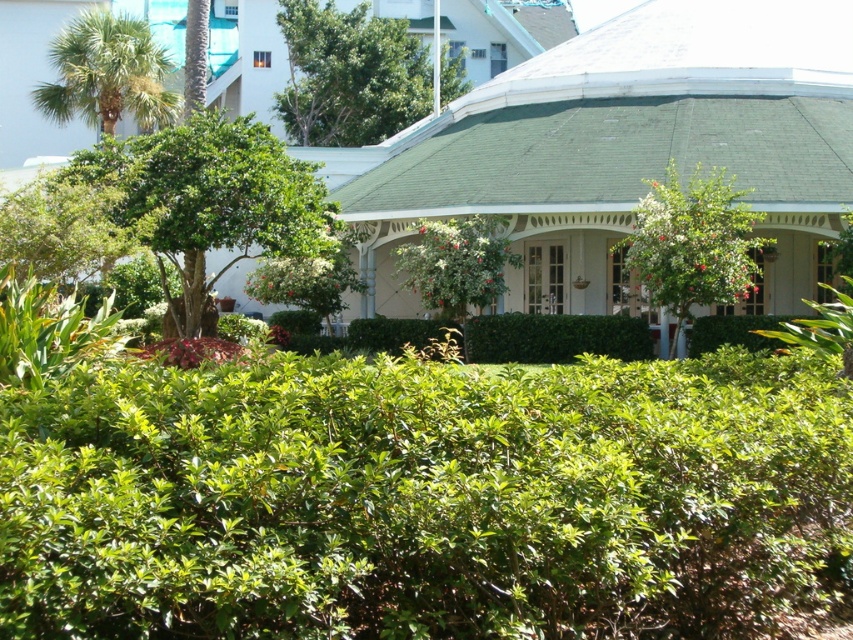
Where is `green leafy hedge at center`? Image resolution: width=853 pixels, height=640 pixels. green leafy hedge at center is located at coordinates (424, 499).

Locate an element on the screen. The width and height of the screenshot is (853, 640). green leafy hedge at center is located at coordinates (424, 499).

Can you confirm if green leafy hedge at center is positioned to the left of green leafy tree at upper center?

Incorrect, green leafy hedge at center is not on the left side of green leafy tree at upper center.

Between green leafy hedge at center and green leafy tree at upper center, which one has less height?

green leafy hedge at center is shorter.

Is point (532, 481) behind point (381, 17)?

No, it is in front of (381, 17).

Image resolution: width=853 pixels, height=640 pixels. I want to click on green leafy hedge at center, so click(x=424, y=499).

Is green leafy hedge at center shorter than green leafy tree at center?

Yes.

Which is behind, point (576, 513) or point (708, 195)?

Point (708, 195)

The width and height of the screenshot is (853, 640). I want to click on green leafy hedge at center, so click(424, 499).